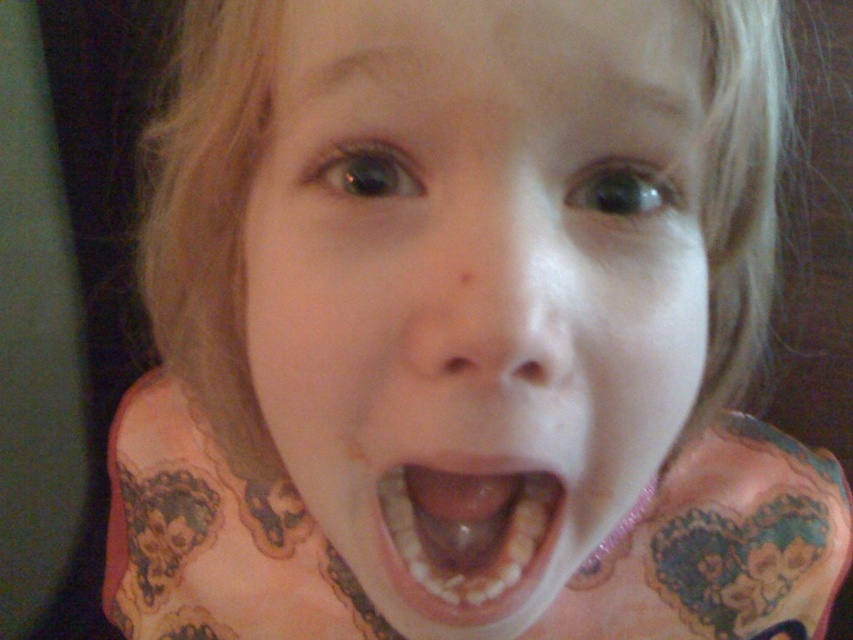
Question: Is pale skin at center to the right of yellowish toothpaste at center from the viewer's perspective?

Choices:
 (A) yes
 (B) no

Answer: (A)

Question: Is pale skin at center smaller than yellowish toothpaste at center?

Choices:
 (A) no
 (B) yes

Answer: (A)

Question: Which point appears farthest from the camera in this image?

Choices:
 (A) (525, 484)
 (B) (486, 406)

Answer: (A)

Question: Which point is closer to the camera taking this photo?

Choices:
 (A) (462, 564)
 (B) (521, 316)

Answer: (B)

Question: Which of the following is the closest to the observer?

Choices:
 (A) pale skin at center
 (B) yellowish toothpaste at center

Answer: (A)

Question: From the image, what is the correct spatial relationship of pale skin at center in relation to yellowish toothpaste at center?

Choices:
 (A) above
 (B) below

Answer: (A)